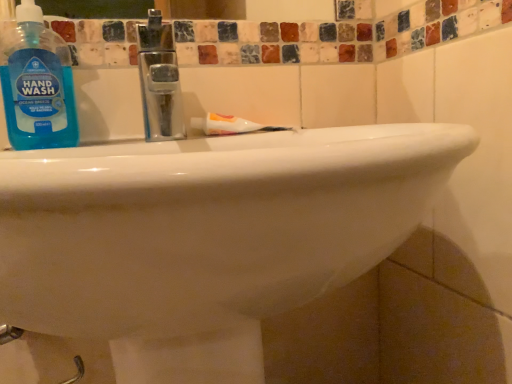
Identify the location of white glossy toothpaste at center. pos(231,125).

What do you see at coordinates (231, 125) in the screenshot? The image size is (512, 384). I see `white glossy toothpaste at center` at bounding box center [231, 125].

Identify the location of blue translucent liquid hand wash at upper left. (37, 84).

Describe the element at coordinates (37, 84) in the screenshot. I see `blue translucent liquid hand wash at upper left` at that location.

I want to click on white glossy toothpaste at center, so click(231, 125).

Can you confirm if white glossy toothpaste at center is positioned to the right of blue translucent liquid hand wash at upper left?

Yes.

Between white glossy toothpaste at center and blue translucent liquid hand wash at upper left, which one is positioned behind?

Positioned behind is white glossy toothpaste at center.

Is point (255, 126) positioned in front of point (63, 128)?

No, (255, 126) is further to viewer.

From the image's perspective, which one is positioned lower, white glossy toothpaste at center or blue translucent liquid hand wash at upper left?

white glossy toothpaste at center is shown below in the image.

From a real-world perspective, is white glossy toothpaste at center under blue translucent liquid hand wash at upper left?

Yes.

Considering the sizes of objects white glossy toothpaste at center and blue translucent liquid hand wash at upper left in the image provided, who is thinner, white glossy toothpaste at center or blue translucent liquid hand wash at upper left?

white glossy toothpaste at center.

Can you confirm if white glossy toothpaste at center is shorter than blue translucent liquid hand wash at upper left?

Yes, white glossy toothpaste at center is shorter than blue translucent liquid hand wash at upper left.

In terms of size, does white glossy toothpaste at center appear bigger or smaller than blue translucent liquid hand wash at upper left?

white glossy toothpaste at center is smaller than blue translucent liquid hand wash at upper left.

Is white glossy toothpaste at center surrounding blue translucent liquid hand wash at upper left?

No, blue translucent liquid hand wash at upper left is not a part of white glossy toothpaste at center.

Is white glossy toothpaste at center beside blue translucent liquid hand wash at upper left?

white glossy toothpaste at center and blue translucent liquid hand wash at upper left are not in contact.

Is white glossy toothpaste at center facing towards blue translucent liquid hand wash at upper left?

No, white glossy toothpaste at center is not oriented towards blue translucent liquid hand wash at upper left.

Can you tell me how much white glossy toothpaste at center and blue translucent liquid hand wash at upper left differ in facing direction?

17 degrees separate the facing orientations of white glossy toothpaste at center and blue translucent liquid hand wash at upper left.

Measure the distance from white glossy toothpaste at center to blue translucent liquid hand wash at upper left.

The distance of white glossy toothpaste at center from blue translucent liquid hand wash at upper left is 8.76 inches.

The image size is (512, 384). Identify the location of cleaning product above the white glossy toothpaste at center (from a real-world perspective). (37, 84).

Which is more to the right, blue translucent liquid hand wash at upper left or white glossy toothpaste at center?

white glossy toothpaste at center.

Which object is closer to the camera taking this photo, blue translucent liquid hand wash at upper left or white glossy toothpaste at center?

blue translucent liquid hand wash at upper left is in front.

Is point (23, 41) closer or farther from the camera than point (209, 114)?

Clearly, point (23, 41) is closer to the camera than point (209, 114).

From the image's perspective, is blue translucent liquid hand wash at upper left located above white glossy toothpaste at center?

Yes, from the image's perspective, blue translucent liquid hand wash at upper left is on top of white glossy toothpaste at center.

From a real-world perspective, is blue translucent liquid hand wash at upper left positioned above or below white glossy toothpaste at center?

Clearly, from a real-world perspective, blue translucent liquid hand wash at upper left is above white glossy toothpaste at center.

Is blue translucent liquid hand wash at upper left wider than white glossy toothpaste at center?

Indeed, blue translucent liquid hand wash at upper left has a greater width compared to white glossy toothpaste at center.

Considering the relative sizes of blue translucent liquid hand wash at upper left and white glossy toothpaste at center in the image provided, is blue translucent liquid hand wash at upper left taller than white glossy toothpaste at center?

Yes, blue translucent liquid hand wash at upper left is taller than white glossy toothpaste at center.

Is blue translucent liquid hand wash at upper left smaller than white glossy toothpaste at center?

Actually, blue translucent liquid hand wash at upper left might be larger than white glossy toothpaste at center.

Looking at this image, is white glossy toothpaste at center located within blue translucent liquid hand wash at upper left?

Definitely not — white glossy toothpaste at center is not inside blue translucent liquid hand wash at upper left.

Is blue translucent liquid hand wash at upper left with white glossy toothpaste at center?

No, blue translucent liquid hand wash at upper left is not beside white glossy toothpaste at center.

Is blue translucent liquid hand wash at upper left facing towards white glossy toothpaste at center?

No, blue translucent liquid hand wash at upper left is not oriented towards white glossy toothpaste at center.

How distant is blue translucent liquid hand wash at upper left from white glossy toothpaste at center?

blue translucent liquid hand wash at upper left and white glossy toothpaste at center are 8.76 inches apart.

Where is `toothpaste below the blue translucent liquid hand wash at upper left (from the image's perspective)`? toothpaste below the blue translucent liquid hand wash at upper left (from the image's perspective) is located at coordinates (231, 125).

Identify the location of toothpaste below the blue translucent liquid hand wash at upper left (from a real-world perspective). [231, 125].

Locate an element on the screen. This screenshot has height=384, width=512. cleaning product in front of the white glossy toothpaste at center is located at coordinates (x=37, y=84).